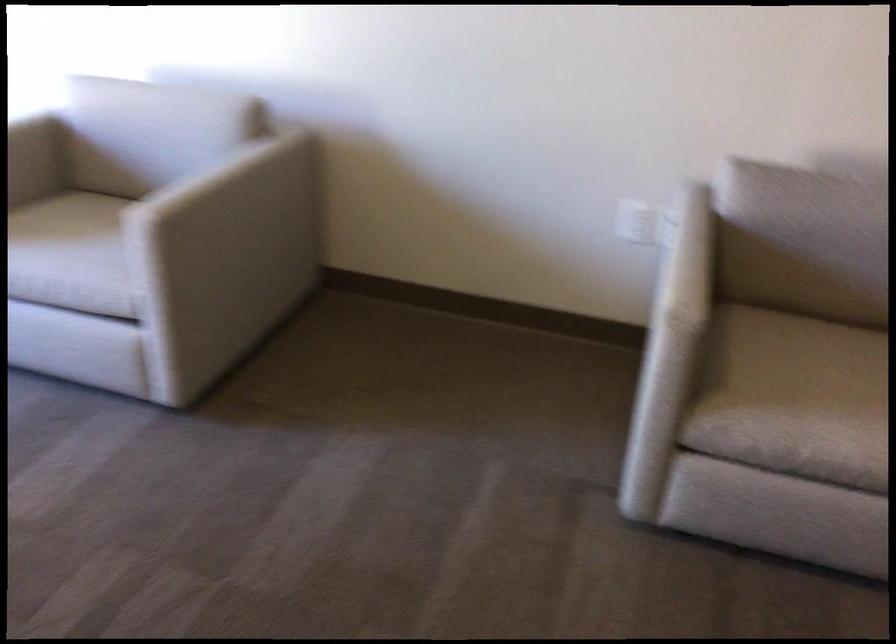
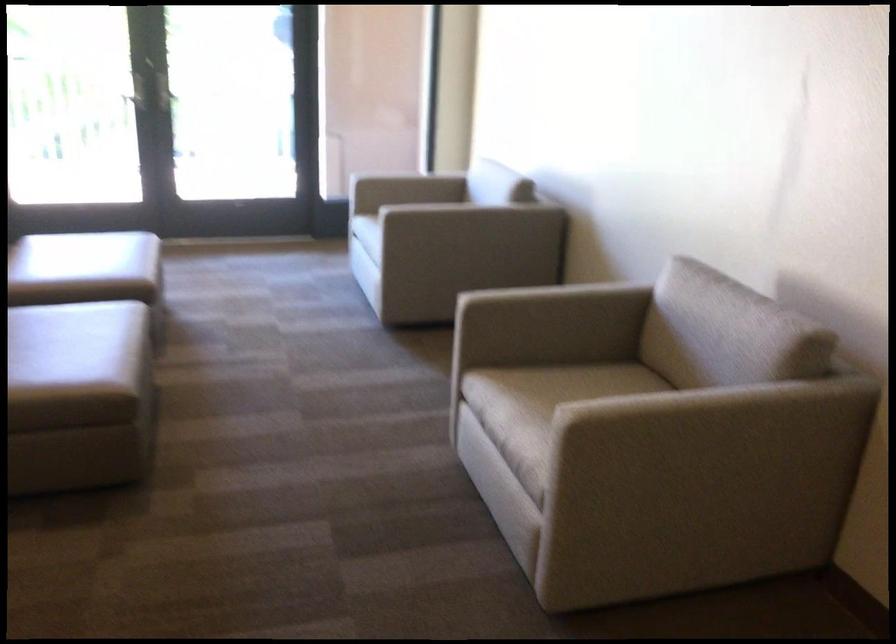
Find the pixel in the second image that matches point (209, 180) in the first image.

(428, 202)